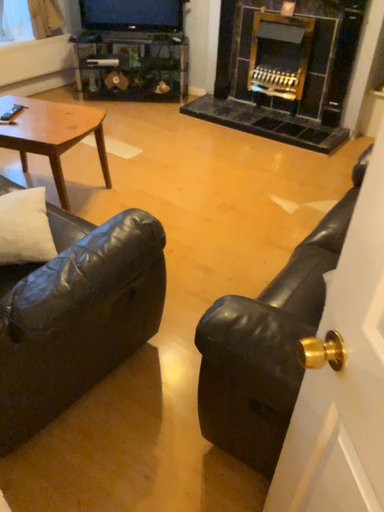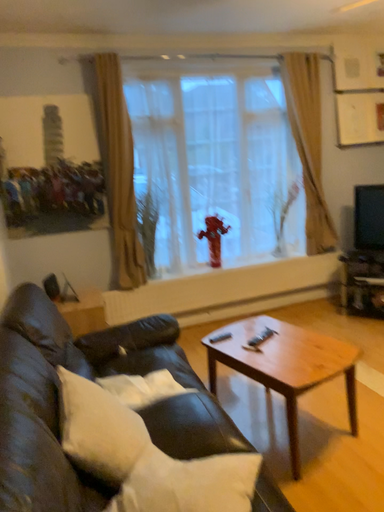
Question: Which way did the camera rotate in the video?

Choices:
 (A) rotated left
 (B) rotated right

Answer: (A)